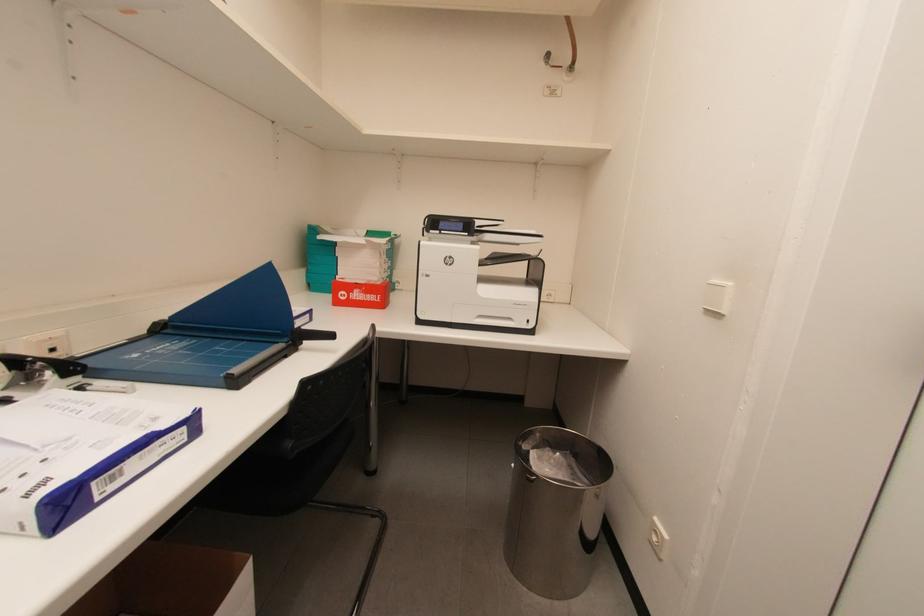
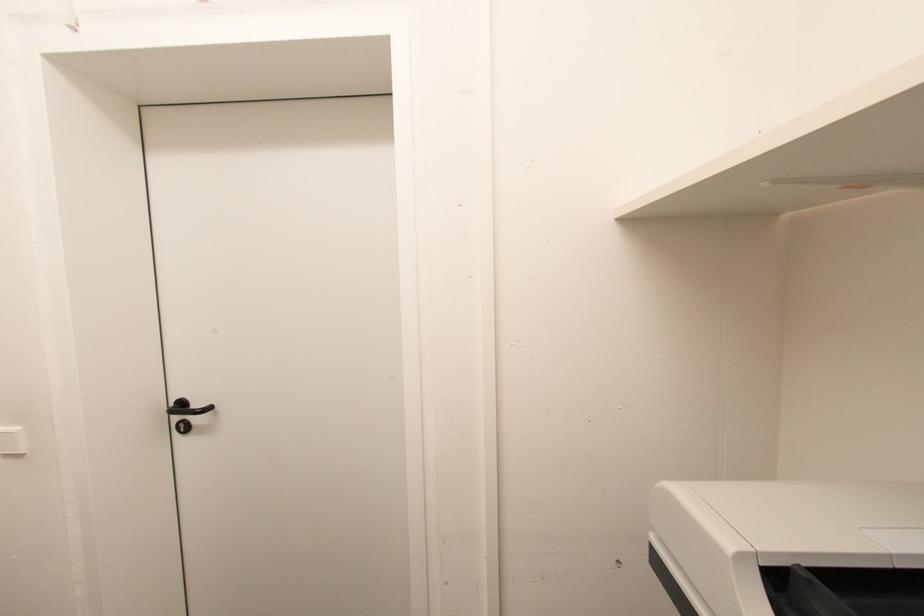
Question: The camera is either moving clockwise (left) or counter-clockwise (right) around the object. The first image is from the beginning of the video and the second image is from the end. Is the camera moving left or right when shooting the video?

Choices:
 (A) Left
 (B) Right

Answer: (A)